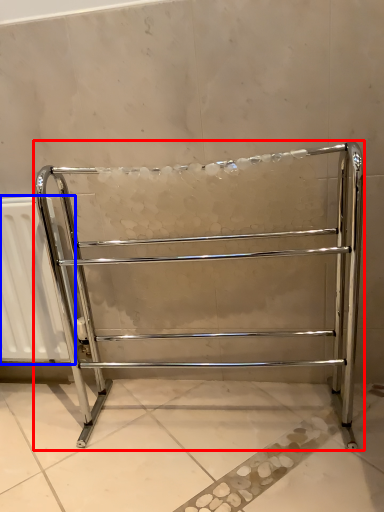
Question: Which of the following is the farthest to the observer, furniture (highlighted by a red box) or radiator (highlighted by a blue box)?

Choices:
 (A) furniture
 (B) radiator

Answer: (B)